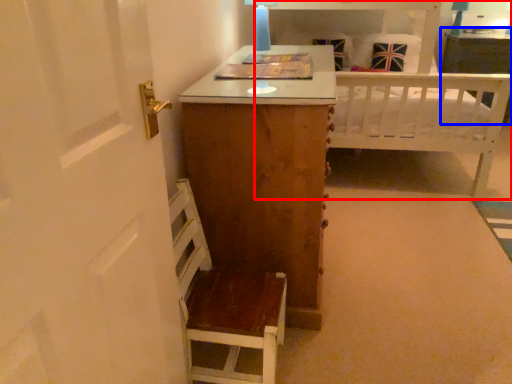
Question: Among these objects, which one is nearest to the camera, bed (highlighted by a red box) or vanity (highlighted by a blue box)?

Choices:
 (A) bed
 (B) vanity

Answer: (A)